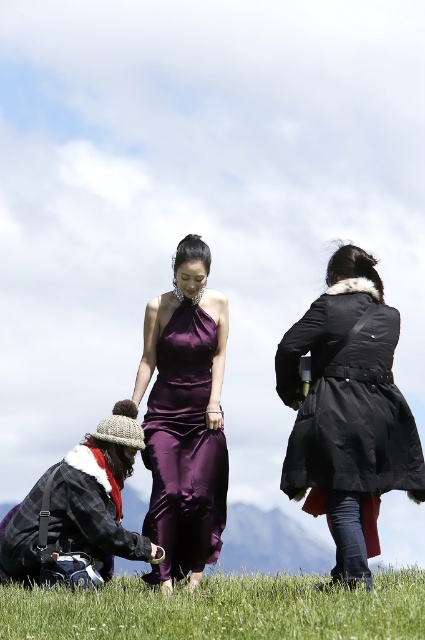
Who is positioned more to the left, green grass at lower center or satin purple dress at center?

satin purple dress at center is more to the left.

Does green grass at lower center have a larger size compared to satin purple dress at center?

Indeed, green grass at lower center has a larger size compared to satin purple dress at center.

At what (x,y) coordinates should I click in order to perform the action: click on green grass at lower center. Please return your answer as a coordinate pair (x, y). Image resolution: width=425 pixels, height=640 pixels. Looking at the image, I should click on (220, 609).

Can you confirm if green grass at lower center is positioned above black matte coat at center?

No, green grass at lower center is not above black matte coat at center.

Between point (8, 586) and point (359, 372), which one is positioned behind?

Point (8, 586)

You are a GUI agent. You are given a task and a screenshot of the screen. Output one action in this format:
    pyautogui.click(x=<x>, y=<y>)
    Task: Click on the green grass at lower center
    This screenshot has height=640, width=425.
    Given the screenshot: What is the action you would take?
    pyautogui.click(x=220, y=609)

Can you confirm if black matte coat at center is positioned to the right of satin purple dress at center?

A: Indeed, black matte coat at center is positioned on the right side of satin purple dress at center.

This screenshot has height=640, width=425. Describe the element at coordinates (348, 397) in the screenshot. I see `black matte coat at center` at that location.

This screenshot has height=640, width=425. I want to click on black matte coat at center, so click(x=348, y=397).